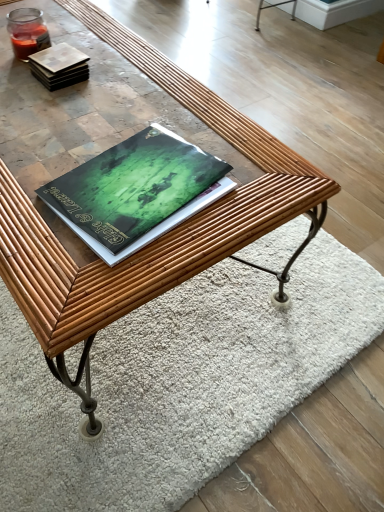
The image size is (384, 512). Identify the location of free space to the back side of matte brown tile at upper left, marked as the first book in a top-to-bottom arrangement. (96, 40).